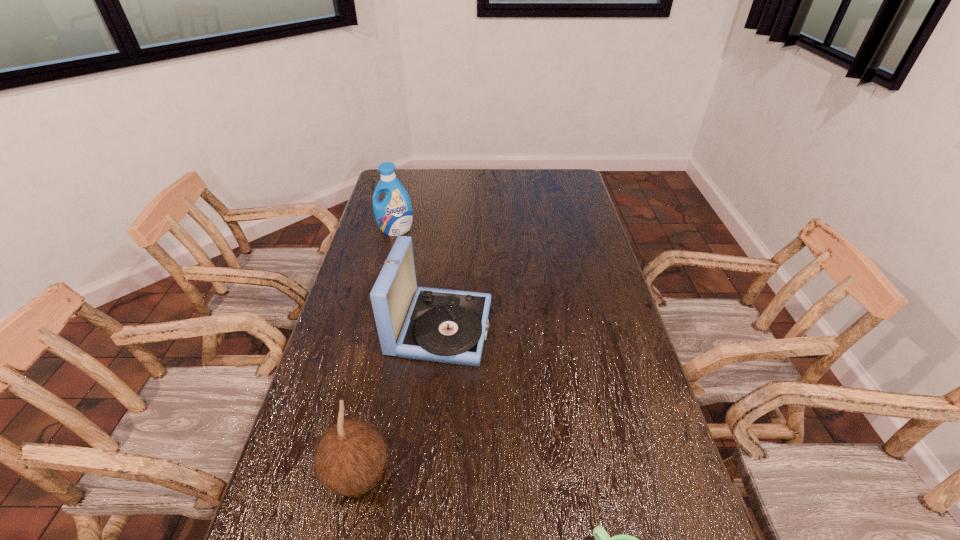
Locate an element on the screen. The image size is (960, 540). the farthest object is located at coordinates (394, 215).

The image size is (960, 540). In order to click on the third nearest object in this screenshot , I will do `click(440, 325)`.

The height and width of the screenshot is (540, 960). Identify the location of the third farthest object. (351, 456).

Where is `free region located on the front-facing side of the farthest object`? Image resolution: width=960 pixels, height=540 pixels. free region located on the front-facing side of the farthest object is located at coordinates (386, 272).

Locate an element on the screen. The width and height of the screenshot is (960, 540). blank area located 0.100m on the left of the phonograph record is located at coordinates (357, 328).

You are a GUI agent. You are given a task and a screenshot of the screen. Output one action in this format:
    pyautogui.click(x=<x>, y=<y>)
    Task: Click on the free region located on the surface of the coconut
    Image resolution: width=960 pixels, height=540 pixels.
    Given the screenshot: What is the action you would take?
    pyautogui.click(x=512, y=474)

This screenshot has height=540, width=960. In order to click on detergent present at the left edge in this screenshot , I will do `click(394, 215)`.

This screenshot has height=540, width=960. I want to click on coconut that is at the left edge, so [351, 456].

The height and width of the screenshot is (540, 960). I want to click on vacant space at the far edge of the desktop, so click(x=418, y=180).

This screenshot has width=960, height=540. Find the location of `free spot at the left edge of the desktop`. free spot at the left edge of the desktop is located at coordinates (375, 257).